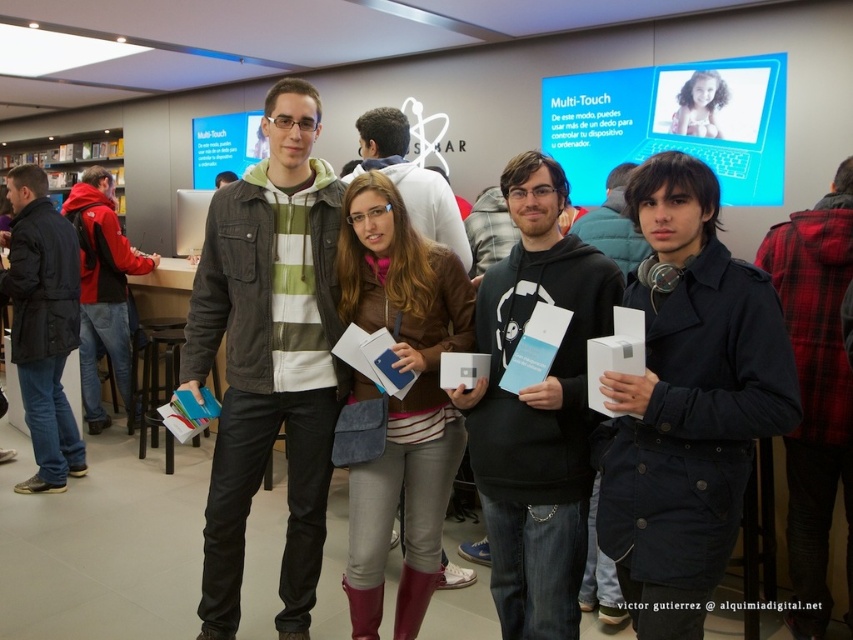
Question: Is brown leather jacket at center to the left of matte brown jacket at center from the viewer's perspective?

Choices:
 (A) no
 (B) yes

Answer: (A)

Question: Estimate the real-world distances between objects in this image. Which object is closer to the blue glossy poster at upper center?

Choices:
 (A) brown leather jacket at center
 (B) black matte hoodie at center

Answer: (A)

Question: Is brown leather jacket at center positioned in front of matte black jacket at center?

Choices:
 (A) no
 (B) yes

Answer: (B)

Question: Is dark gray corduroy jacket at center thinner than brown leather jacket at center?

Choices:
 (A) no
 (B) yes

Answer: (A)

Question: Which object is positioned farthest from the dark gray corduroy jacket at center?

Choices:
 (A) matte black jacket at center
 (B) red plaid jacket at center

Answer: (A)

Question: Which point is closer to the camera?

Choices:
 (A) (102, 266)
 (B) (402, 182)
 (C) (56, 440)

Answer: (B)